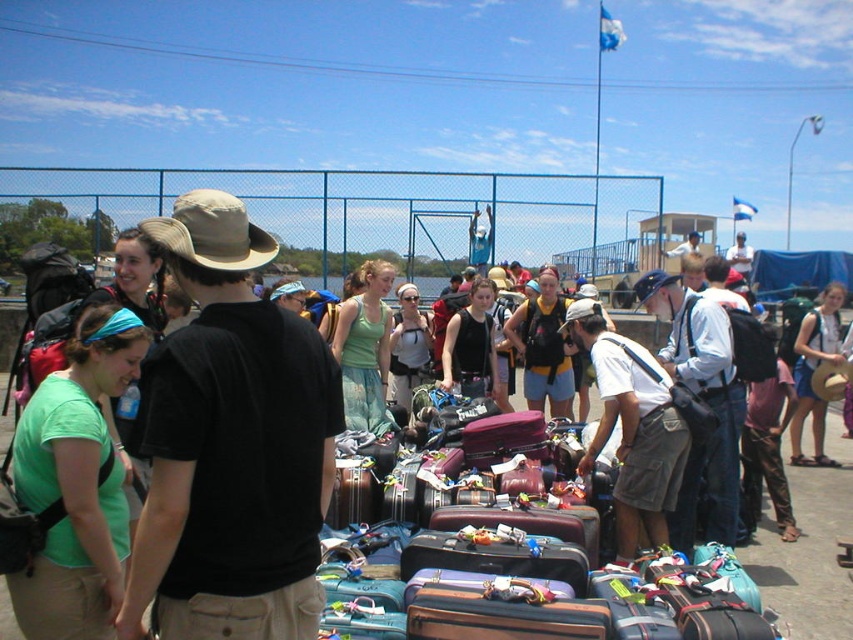
Question: Is green matte shirt at lower left positioned before khaki shorts at center?

Choices:
 (A) yes
 (B) no

Answer: (A)

Question: In this image, where is khaki shorts at center located relative to matte black backpack at center?

Choices:
 (A) above
 (B) below

Answer: (B)

Question: Which point is closer to the camera?

Choices:
 (A) brown straw hat at center
 (B) black cotton shirt at center
 (C) matte black backpack at center

Answer: (B)

Question: Does khaki shorts at center appear on the right side of black matte tank top at center?

Choices:
 (A) no
 (B) yes

Answer: (B)

Question: Which of these objects is positioned farthest from the black cotton shirt at center?

Choices:
 (A) green matte shirt at lower left
 (B) black matte tank top at center
 (C) multicolored fabric suitcase at center
 (D) brown straw hat at center

Answer: (D)

Question: Which object is closer to the camera taking this photo?

Choices:
 (A) khaki shorts at center
 (B) multicolored fabric suitcase at center

Answer: (B)